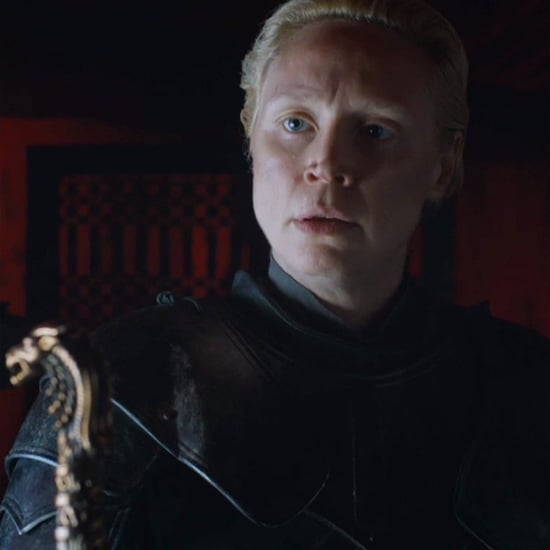
Find the location of a particular element. back of a chair is located at coordinates (136, 159).